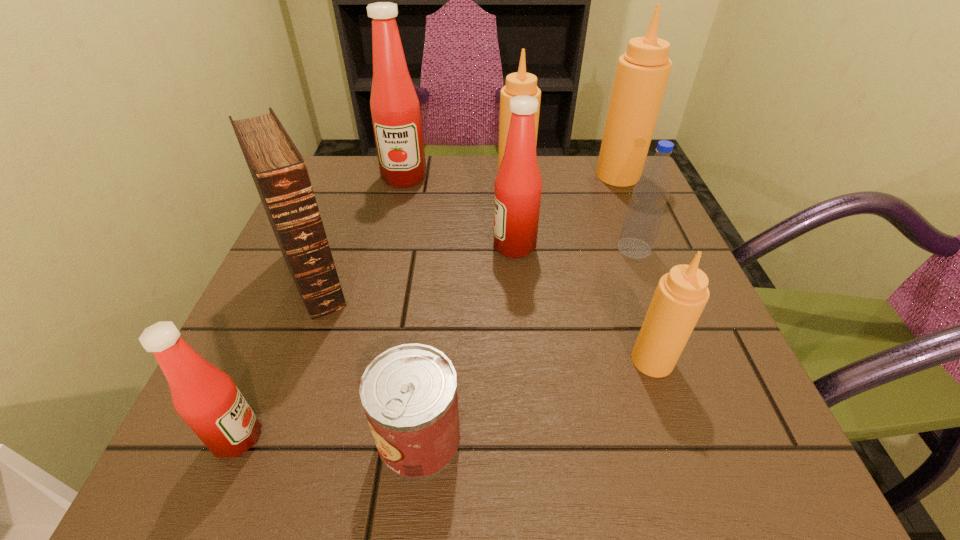
You are a GUI agent. You are given a task and a screenshot of the screen. Output one action in this format:
    pyautogui.click(x=<x>, y=<y>)
    Task: Click on the nearest red condiment
    This screenshot has height=540, width=960.
    Given the screenshot: What is the action you would take?
    pyautogui.click(x=206, y=398)

Locate an element on the screen. The height and width of the screenshot is (540, 960). the smallest red condiment is located at coordinates (206, 398).

Locate an element on the screen. the shortest object is located at coordinates (409, 392).

Locate an element on the screen. The image size is (960, 540). vacant space situated 0.270m on the left of the biggest tan condiment is located at coordinates (488, 175).

I want to click on vacant area located on the front-facing side of the fifth condiment from right to left, so click(x=385, y=263).

Locate an element on the screen. This screenshot has height=540, width=960. vacant area located on the front of the leftmost tan condiment is located at coordinates (527, 293).

Find the location of a particular element. The height and width of the screenshot is (540, 960). vacant space located 0.080m on the front-facing side of the second nearest red condiment is located at coordinates (454, 246).

I want to click on vacant space situated 0.350m on the front-facing side of the second nearest red condiment, so click(322, 246).

Where is `free space located 0.250m on the front-facing side of the second nearest red condiment`? free space located 0.250m on the front-facing side of the second nearest red condiment is located at coordinates (371, 246).

I want to click on blank area located 0.310m on the back of the Bible, so click(x=357, y=167).